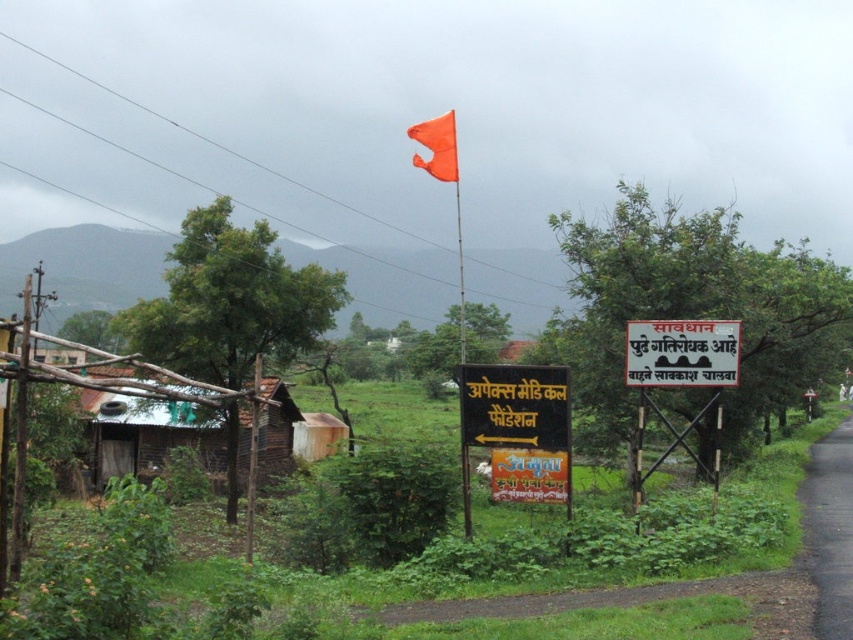
You are a delivery person who needs to read the text on the white plastic signboard at center and the orange fabric flag at center. Which object will you need to look at more closely because it has a smaller surface area?

The orange fabric flag at center has a smaller surface area than the white plastic signboard at center, so you will need to look at it more closely.

You are a hiker who needs to adjust the distance between the white plastic signboard at center and the orange fabric flag at center to exactly 25 feet. Currently, they are 30.65 feet apart. How much distance do you need to reduce between them?

The current distance between the white plastic signboard at center and the orange fabric flag at center is 30.65 feet. To achieve the desired 25 feet, you need to reduce the distance by 5.65 feet.